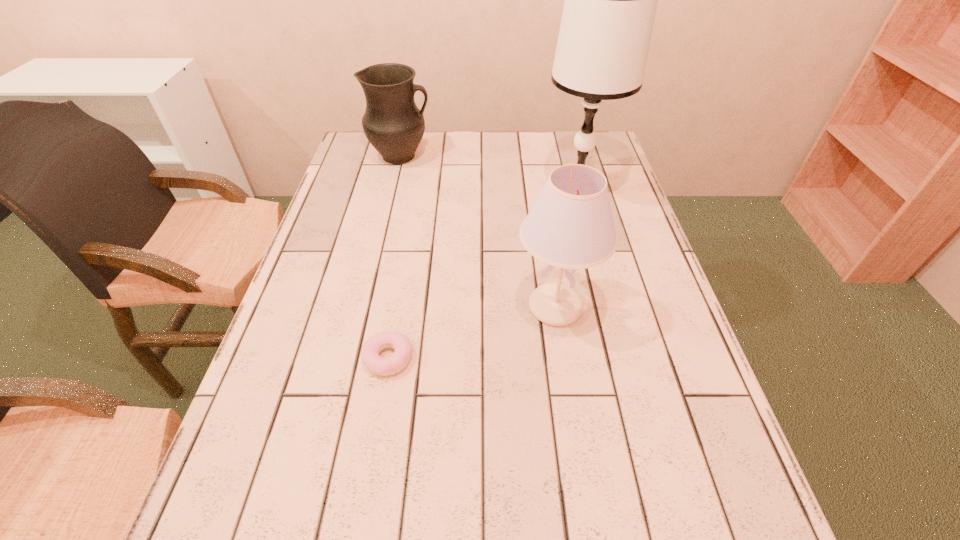
Image resolution: width=960 pixels, height=540 pixels. Find the location of `the tallest object`. the tallest object is located at coordinates (610, 4).

Identify the location of the second tallest object. This screenshot has height=540, width=960. (570, 225).

At what (x,y) coordinates should I click in order to perform the action: click on the second shortest object. Please return your answer as a coordinate pair (x, y). The height and width of the screenshot is (540, 960). Looking at the image, I should click on (393, 124).

Identify the location of the shortest object. (399, 342).

I want to click on vacant space situated 0.190m on the front of the table lamp, so click(x=594, y=264).

Where is `free location located 0.080m on the front of the second tallest object`? The width and height of the screenshot is (960, 540). free location located 0.080m on the front of the second tallest object is located at coordinates (565, 374).

Locate an element on the screen. This screenshot has width=960, height=540. vacant area situated on the handle side of the pitcher is located at coordinates (554, 156).

Where is `free space located 0.270m on the back of the shortest object`? Image resolution: width=960 pixels, height=540 pixels. free space located 0.270m on the back of the shortest object is located at coordinates point(406,251).

At what (x,y) coordinates should I click in order to perform the action: click on object that is positioned at the far edge. Please return your answer as a coordinate pair (x, y). Looking at the image, I should click on (393, 124).

Where is `object that is at the left edge`? object that is at the left edge is located at coordinates (393, 124).